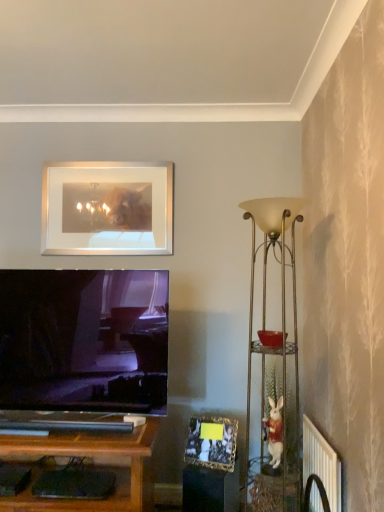
Question: Is point (322, 480) positioned closer to the camera than point (223, 446)?

Choices:
 (A) closer
 (B) farther

Answer: (A)

Question: From a real-world perspective, is white plastic radiator at lower right above or below gold metallic photo frame at lower center, acting as the 2th picture frame starting from the top?

Choices:
 (A) below
 (B) above

Answer: (A)

Question: Which object is positioned farthest from the white plastic radiator at lower right?

Choices:
 (A) silver/metallic picture frame at upper center, which is the 1th picture frame in top-to-bottom order
 (B) metallic gold floor lamp at right
 (C) white ceramic rabbit at right
 (D) gold metallic photo frame at lower center, placed as the 2th picture frame when sorted from left to right

Answer: (A)

Question: Estimate the real-world distances between objects in this image. Which object is farther from the silver/metallic picture frame at upper center, placed as the second picture frame when sorted from bottom to top?

Choices:
 (A) white ceramic rabbit at right
 (B) white plastic radiator at lower right
 (C) gold metallic photo frame at lower center, the first picture frame viewed from the front
 (D) metallic gold floor lamp at right

Answer: (B)